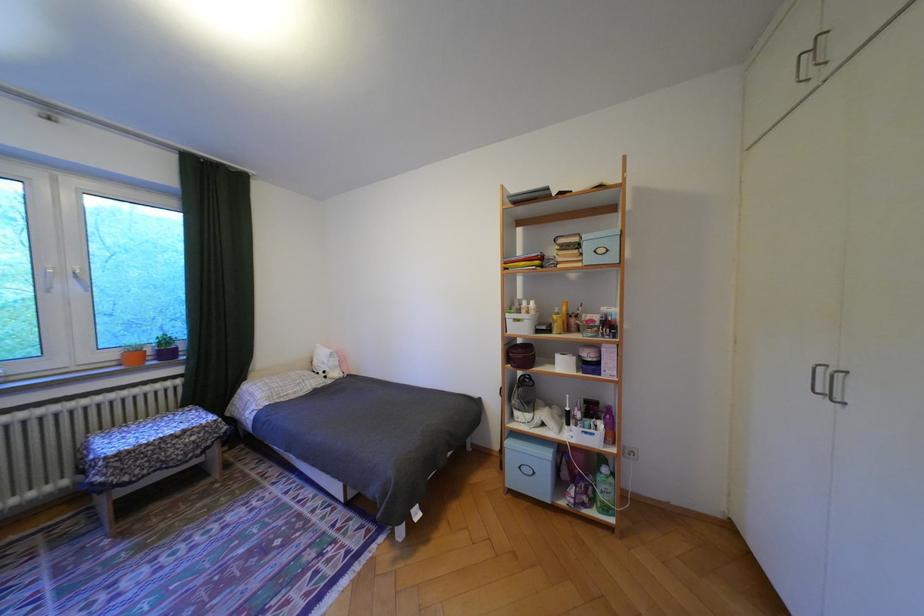
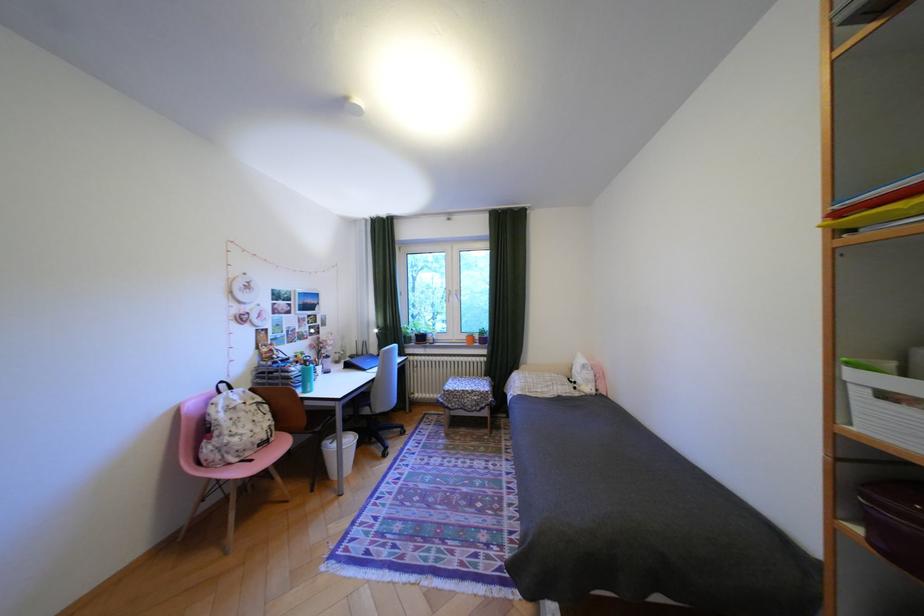
Question: The camera is either moving clockwise (left) or counter-clockwise (right) around the object. The first image is from the beginning of the video and the second image is from the end. Is the camera moving left or right when shooting the video?

Choices:
 (A) Left
 (B) Right

Answer: (B)